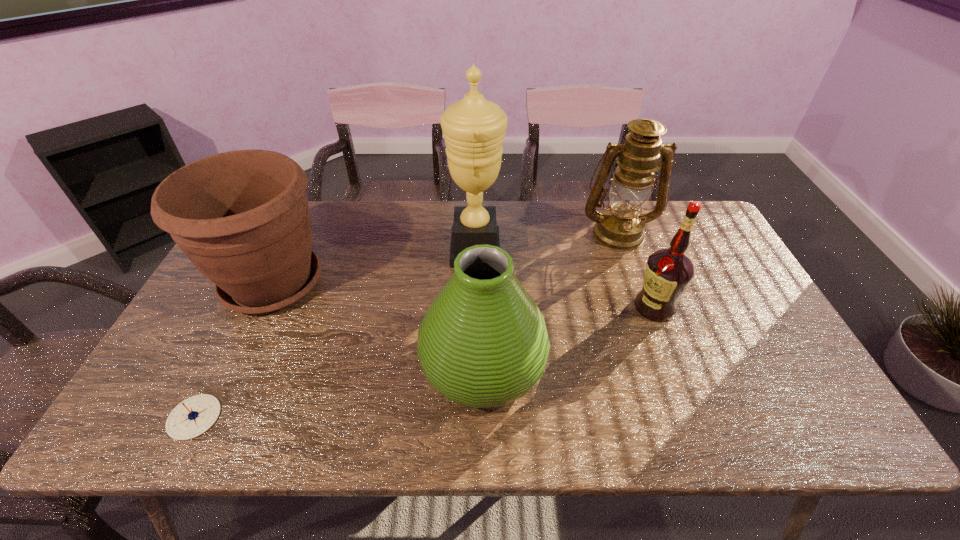
Where is `vacant area located 0.100m on the label of the alcohol`? Image resolution: width=960 pixels, height=540 pixels. vacant area located 0.100m on the label of the alcohol is located at coordinates (597, 307).

Locate an element on the screen. The width and height of the screenshot is (960, 540). vacant space located on the right of the flowerpot is located at coordinates (423, 283).

Identify the location of free space located on the left of the vase. (375, 366).

Locate an element on the screen. The image size is (960, 540). free space located on the left of the compass is located at coordinates (142, 417).

In order to click on trophy cup that is at the far edge in this screenshot , I will do `click(474, 128)`.

What are the coordinates of `oil lamp located at the far edge` in the screenshot? It's located at (621, 227).

Where is `flowerpot that is at the far edge`? The image size is (960, 540). flowerpot that is at the far edge is located at coordinates (242, 217).

Locate an element on the screen. This screenshot has width=960, height=540. vase located in the near edge section of the desktop is located at coordinates (483, 343).

The width and height of the screenshot is (960, 540). Identify the location of compass at the near edge. (192, 417).

Identify the location of flowerpot present at the left edge. (242, 217).